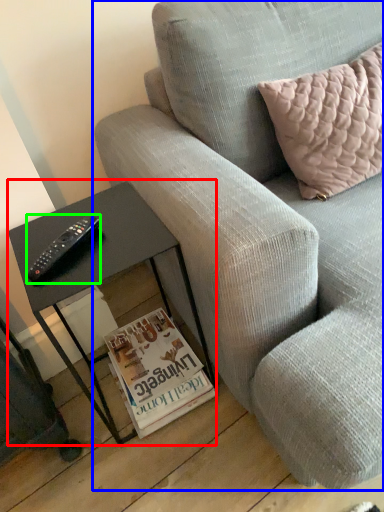
Question: Which is farther away from table (highlighted by a red box)? studio couch (highlighted by a blue box) or remote (highlighted by a green box)?

Choices:
 (A) studio couch
 (B) remote

Answer: (A)